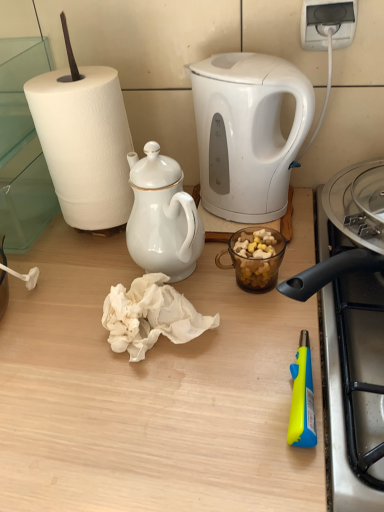
Image resolution: width=384 pixels, height=512 pixels. What are the coordinates of `blank space to the left of white porcelain teapot at upper center` in the screenshot? It's located at (71, 289).